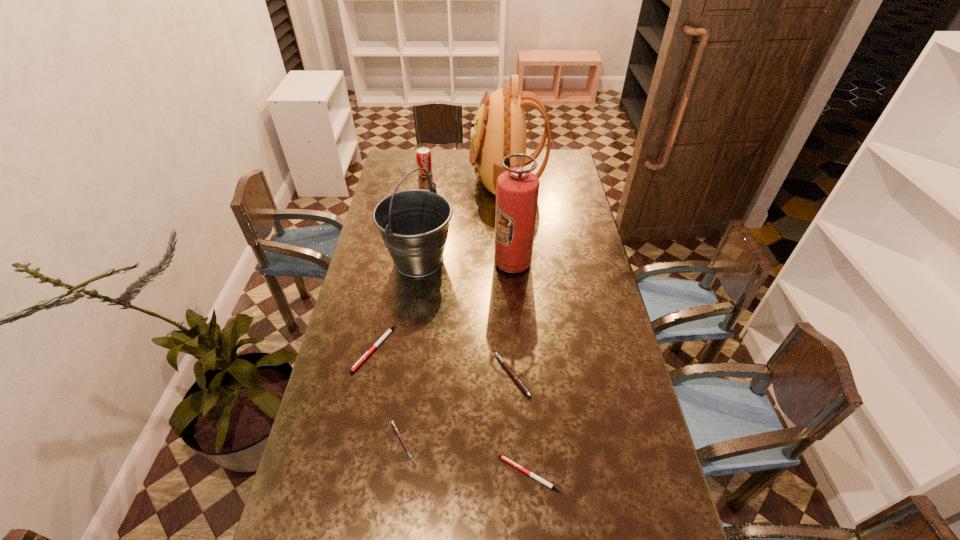
The image size is (960, 540). Identify the location of free spot at the far left corner of the desktop. (402, 159).

Identify the location of free spot at the far right corner of the desktop. This screenshot has height=540, width=960. (554, 167).

Find the location of a particular element. empty space that is in between the smaller white pen and the farther white pen is located at coordinates (452, 411).

The height and width of the screenshot is (540, 960). I want to click on vacant point located between the bigger pink pen and the gray bucket, so click(466, 318).

Locate an element on the screen. This screenshot has width=960, height=540. blank region between the bigger white pen and the bucket is located at coordinates (396, 305).

I want to click on vacant area that lies between the bucket and the beige backpack, so click(x=463, y=219).

This screenshot has width=960, height=540. I want to click on the fifth closest object to the bigger white pen, so click(505, 459).

Choose which object is the third nearest neighbor to the backpack. Please provide its 2D coordinates. Your answer should be formatted as a tuple, i.e. [(x, y)], where the tuple contains the x and y coordinates of a point satisfying the conditions above.

[(517, 189)]

Locate which pen ranks fourth in proximity to the red fire extinguisher. Please provide its 2D coordinates. Your answer should be formatted as a tuple, i.e. [(x, y)], where the tuple contains the x and y coordinates of a point satisfying the conditions above.

[(505, 459)]

Identify the location of pen that can be found as the closest to the gray bucket. (388, 331).